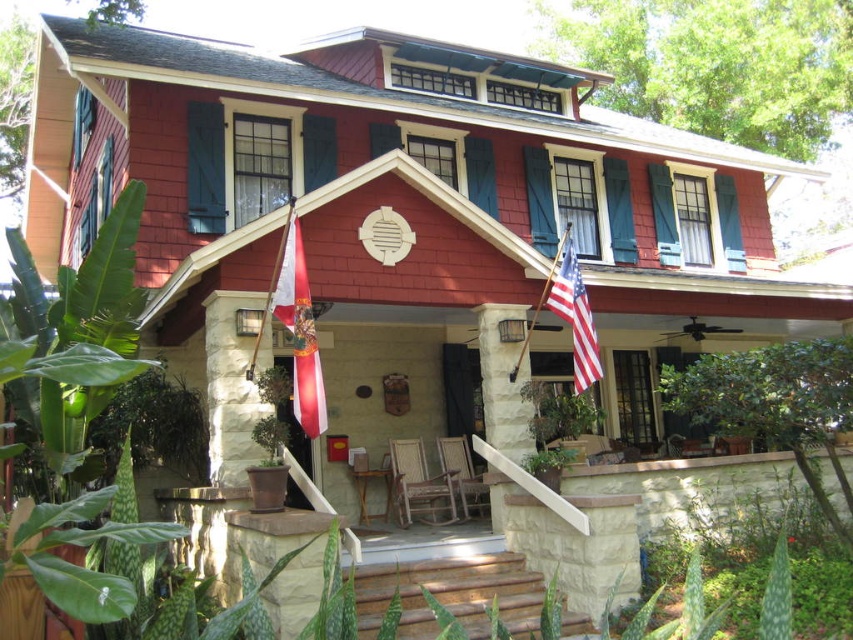
Question: Does red/white striped flag at center appear over american flag at center?

Choices:
 (A) no
 (B) yes

Answer: (A)

Question: Estimate the real-world distances between objects in this image. Which object is farther from the white stucco flagpole at lower left?

Choices:
 (A) american flag at center
 (B) white stone column at center

Answer: (A)

Question: Which object appears closest to the camera in this image?

Choices:
 (A) red/white striped flag at center
 (B) white stone column at center
 (C) white stucco flagpole at lower left
 (D) american flag at center

Answer: (A)

Question: Is white stucco flagpole at lower left further to camera compared to american flag at center?

Choices:
 (A) yes
 (B) no

Answer: (B)

Question: Does red/white striped flag at center come behind american flag at center?

Choices:
 (A) no
 (B) yes

Answer: (A)

Question: Which point appears closest to the camera in this image?

Choices:
 (A) (309, 323)
 (B) (590, 337)
 (C) (527, 403)
 (D) (209, 397)

Answer: (A)